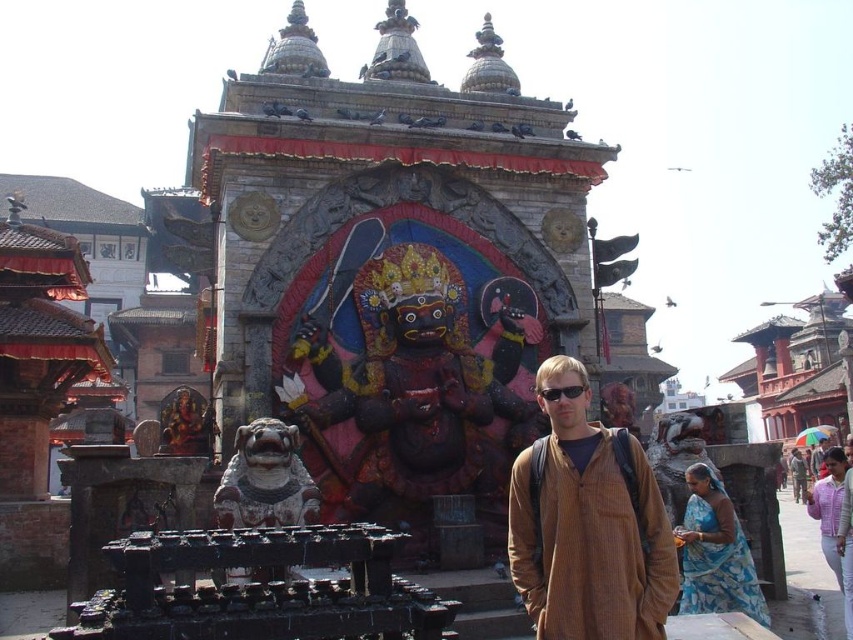
Which is behind, point (280, 394) or point (608, 470)?

The point (280, 394) is behind.

Between polished dark wood statue at center and brown corduroy shirt at center, which one has less height?

With less height is brown corduroy shirt at center.

Between point (430, 513) and point (659, 545), which one is positioned in front?

Positioned in front is point (659, 545).

You are a GUI agent. You are given a task and a screenshot of the screen. Output one action in this format:
    pyautogui.click(x=<x>, y=<y>)
    Task: Click on the polished dark wood statue at center
    
    Given the screenshot: What is the action you would take?
    pyautogui.click(x=408, y=394)

Measure the distance between point (799, 497) and camera.

Point (799, 497) and camera are 130.04 meters apart.

Is point (790, 476) in front of point (553, 388)?

No, (790, 476) is behind (553, 388).

Between point (799, 497) and point (566, 396), which one is positioned behind?

Point (799, 497)

At what (x,y) coordinates should I click in order to perform the action: click on brown woolen sweater at center. Please return your answer as a coordinate pair (x, y). This screenshot has width=853, height=640. Looking at the image, I should click on point(798,476).

Which of these two, black plastic sunglasses at center or brown textured shirt at center, stands taller?

Standing taller between the two is brown textured shirt at center.

Does black plastic sunglasses at center appear over brown textured shirt at center?

Yes.

Is point (569, 388) closer to viewer compared to point (820, 451)?

Yes, point (569, 388) is in front of point (820, 451).

Locate an element on the screen. The width and height of the screenshot is (853, 640). black plastic sunglasses at center is located at coordinates (561, 392).